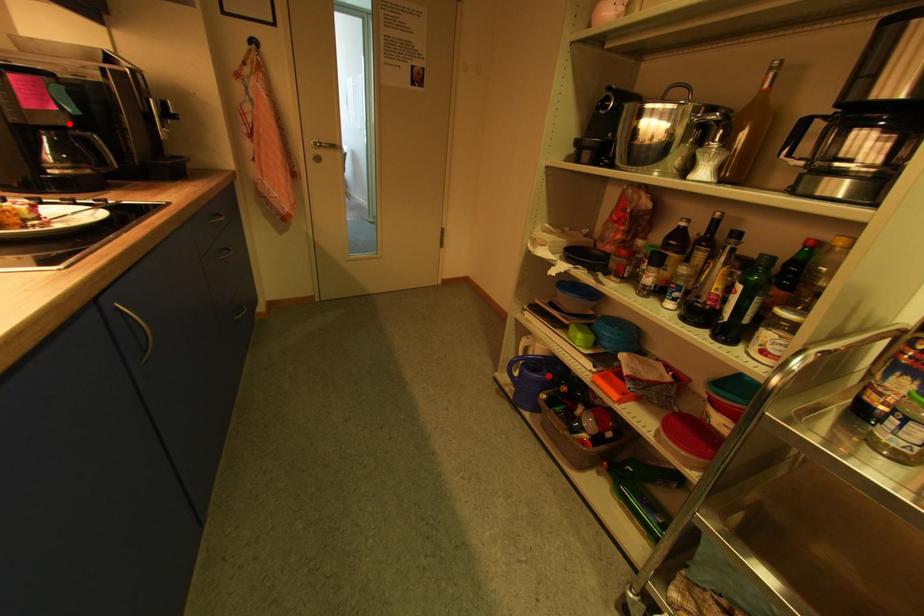
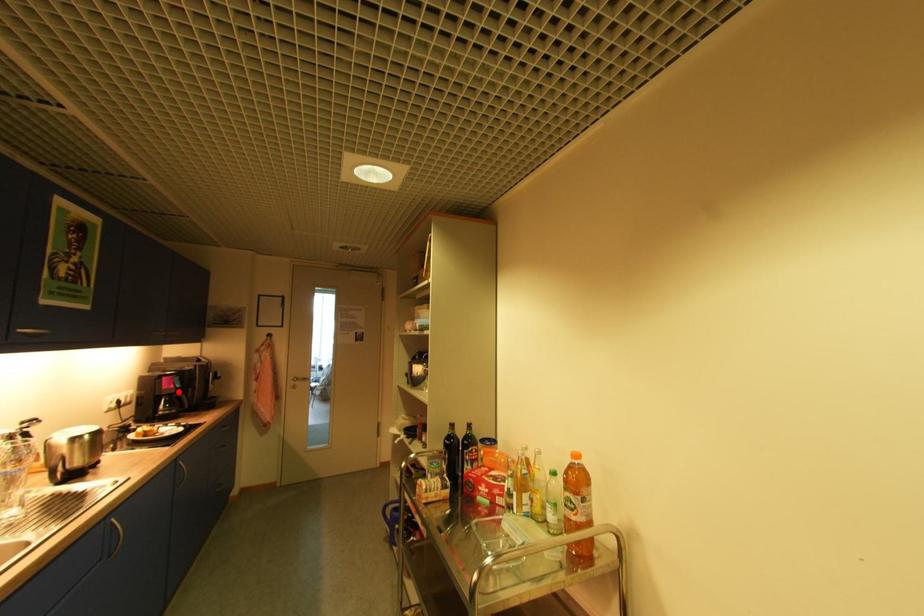
I am providing you with two images of the same scene from different viewpoints. A red point is marked on the first image and another point is marked on the second image. Are the points marked in image1 and image2 representing the same 3D position?

Yes